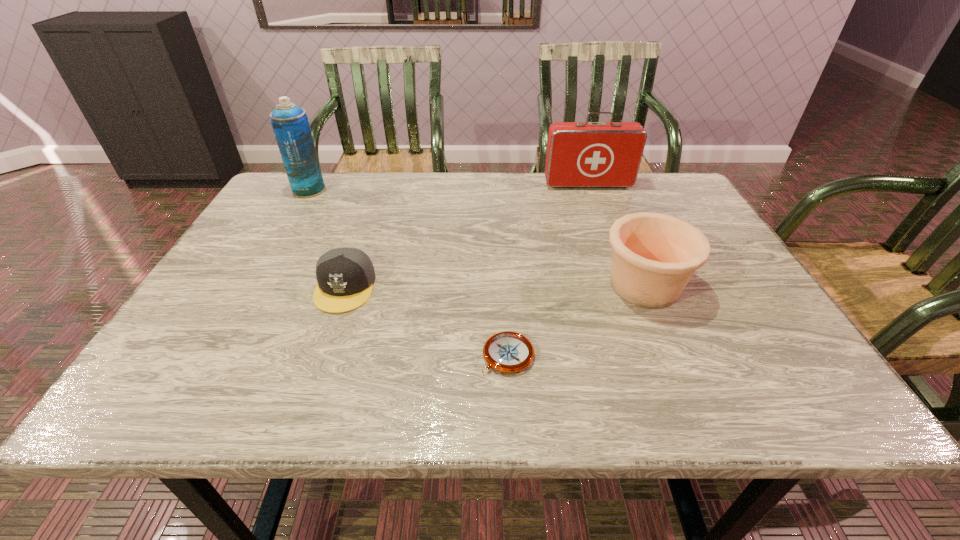
Find the location of `vacant region located on the back of the third shortest object`. vacant region located on the back of the third shortest object is located at coordinates (624, 236).

Locate an element on the screen. This screenshot has width=960, height=540. vacant space positioned 0.070m on the front-facing side of the fourth object from right to left is located at coordinates (327, 340).

Image resolution: width=960 pixels, height=540 pixels. I want to click on vacant region located on the back of the shortest object, so click(504, 291).

I want to click on aerosol can that is at the far edge, so click(290, 124).

You are a GUI agent. You are given a task and a screenshot of the screen. Output one action in this format:
    pyautogui.click(x=<x>, y=<y>)
    Task: Click on the first-aid kit that is at the far edge
    Image resolution: width=960 pixels, height=540 pixels.
    Given the screenshot: What is the action you would take?
    [579, 154]

Where is `object located in the near edge section of the desktop`? Image resolution: width=960 pixels, height=540 pixels. object located in the near edge section of the desktop is located at coordinates (509, 352).

Locate an element on the screen. object at the left edge is located at coordinates tap(290, 124).

Find the location of a particular element. The width and height of the screenshot is (960, 540). the first-aid kit present at the right edge is located at coordinates (579, 154).

You are a GUI agent. You are given a task and a screenshot of the screen. Output one action in this format:
    pyautogui.click(x=<x>, y=<y>)
    Task: Click on the pottery that is at the right edge
    This screenshot has height=540, width=960.
    Given the screenshot: What is the action you would take?
    pyautogui.click(x=654, y=256)

What are the coordinates of `object situated at the far left corner` in the screenshot? It's located at (290, 124).